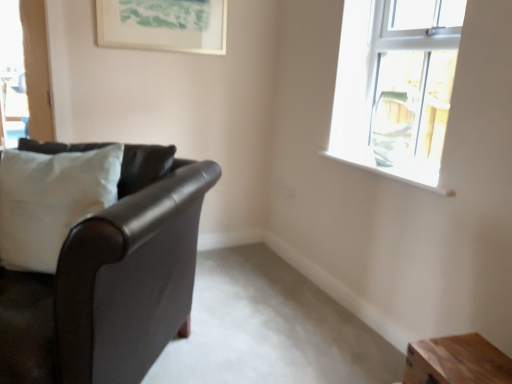
Question: Is clear glass window at upper right positioned with its back to wooden table at lower right?

Choices:
 (A) no
 (B) yes

Answer: (A)

Question: Does clear glass window at upper right appear on the right side of wooden table at lower right?

Choices:
 (A) yes
 (B) no

Answer: (A)

Question: Considering the relative sizes of clear glass window at upper right and wooden table at lower right in the image provided, is clear glass window at upper right wider than wooden table at lower right?

Choices:
 (A) no
 (B) yes

Answer: (B)

Question: From the image's perspective, is clear glass window at upper right located above wooden table at lower right?

Choices:
 (A) no
 (B) yes

Answer: (B)

Question: Can you confirm if clear glass window at upper right is taller than wooden table at lower right?

Choices:
 (A) no
 (B) yes

Answer: (B)

Question: Is matte white picture frame at upper center wider or thinner than wooden table at lower right?

Choices:
 (A) wide
 (B) thin

Answer: (B)

Question: Does point (211, 16) appear closer or farther from the camera than point (467, 337)?

Choices:
 (A) closer
 (B) farther

Answer: (B)

Question: Do you think matte white picture frame at upper center is within wooden table at lower right, or outside of it?

Choices:
 (A) inside
 (B) outside

Answer: (B)

Question: In terms of height, does matte white picture frame at upper center look taller or shorter compared to wooden table at lower right?

Choices:
 (A) tall
 (B) short

Answer: (A)

Question: From a real-world perspective, is wooden table at lower right physically located above or below clear glass window at upper right?

Choices:
 (A) below
 (B) above

Answer: (A)

Question: Looking at the image, does wooden table at lower right seem bigger or smaller compared to clear glass window at upper right?

Choices:
 (A) small
 (B) big

Answer: (A)

Question: Is point (424, 374) closer or farther from the camera than point (381, 71)?

Choices:
 (A) closer
 (B) farther

Answer: (A)

Question: Relative to clear glass window at upper right, is wooden table at lower right in front or behind?

Choices:
 (A) front
 (B) behind

Answer: (A)

Question: Do you think clear glass window at upper right is within white smooth window sill at upper right, or outside of it?

Choices:
 (A) outside
 (B) inside

Answer: (A)

Question: In the image, is clear glass window at upper right positioned in front of or behind white smooth window sill at upper right?

Choices:
 (A) front
 (B) behind

Answer: (A)